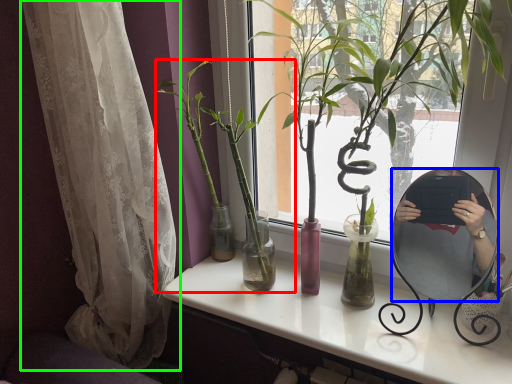
Question: Based on their relative distances, which object is nearer to houseplant (highlighted by a red box)? Choose from mirror (highlighted by a blue box) and curtain (highlighted by a green box).

Choices:
 (A) mirror
 (B) curtain

Answer: (B)